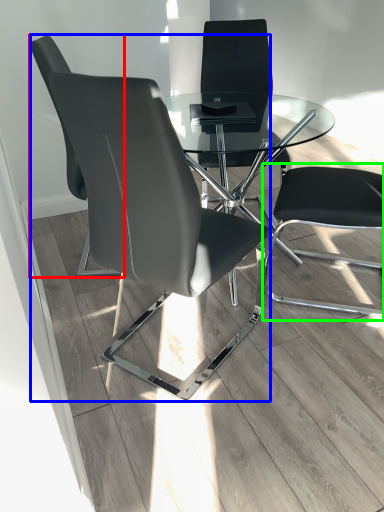
Question: Based on their relative distances, which object is farther from chair (highlighted by a red box)? Choose from chair (highlighted by a blue box) and computer chair (highlighted by a green box).

Choices:
 (A) chair
 (B) computer chair

Answer: (B)